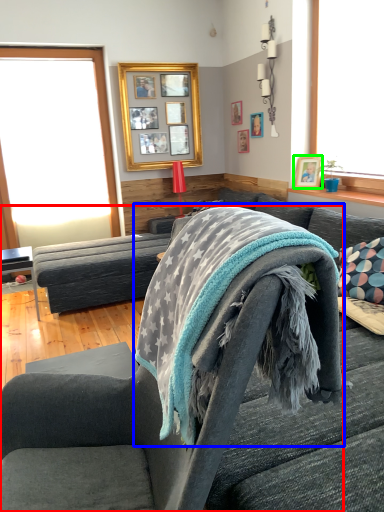
Question: Which object is the farthest from chair (highlighted by a red box)? Choose among these: bath towel (highlighted by a blue box) or picture frame (highlighted by a green box).

Choices:
 (A) bath towel
 (B) picture frame

Answer: (B)